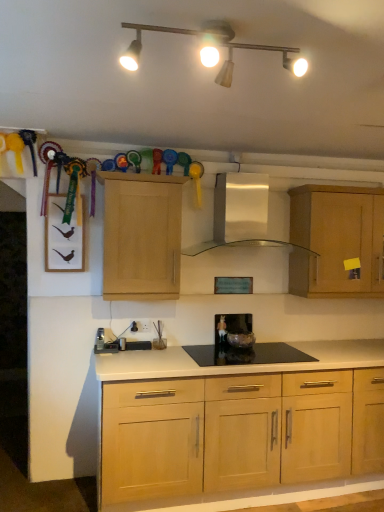
Locate an element on the screen. The height and width of the screenshot is (512, 384). free space above matte white track lights at upper center (from a real-world perspective) is located at coordinates (225, 21).